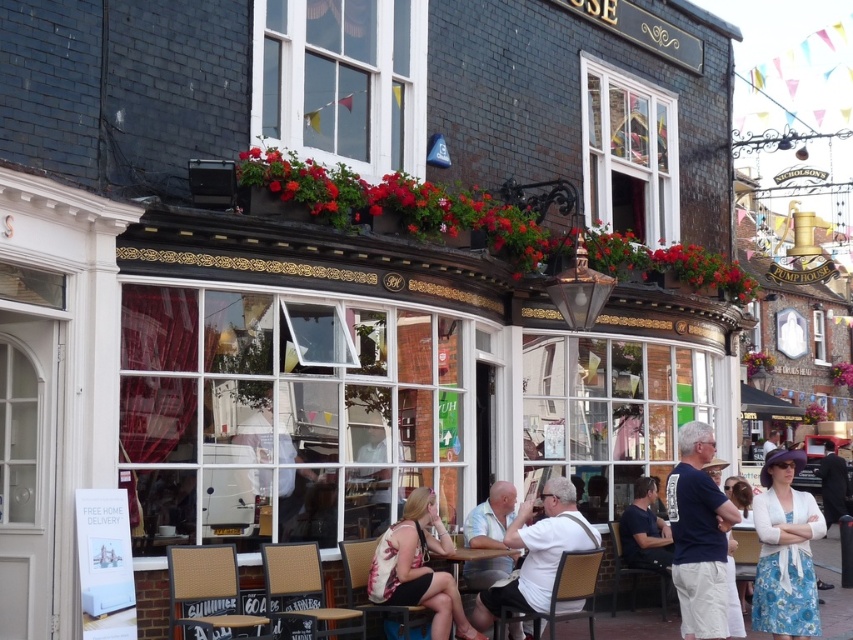
You are a fashion designer observing two outfits in the scene. The floral fabric dress at center and the white fabric shirt at center. Which outfit is taller?

The floral fabric dress at center is taller than the white fabric shirt at center.